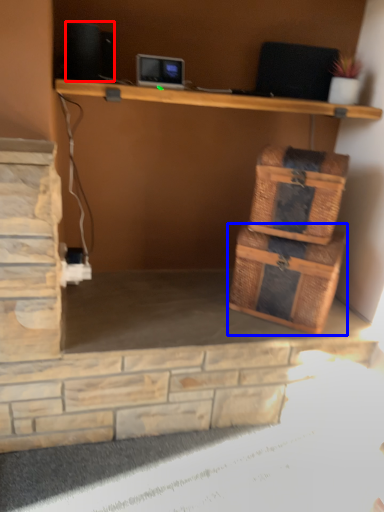
Question: Which of the following is the closest to the observer, speaker (highlighted by a red box) or storage box (highlighted by a blue box)?

Choices:
 (A) speaker
 (B) storage box

Answer: (A)